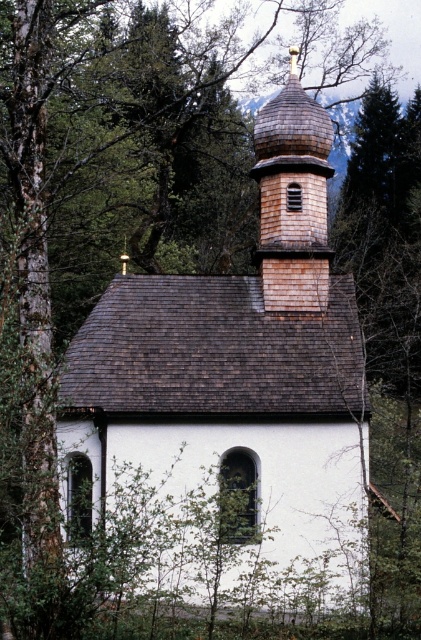
Which is below, white wood church at center or shiny brown shingles at upper center?

white wood church at center is below.

Is white wood church at center below shiny brown shingles at upper center?

Yes.

Identify the location of white wood church at center. (231, 404).

The height and width of the screenshot is (640, 421). In order to click on white wood church at center in this screenshot , I will do `click(231, 404)`.